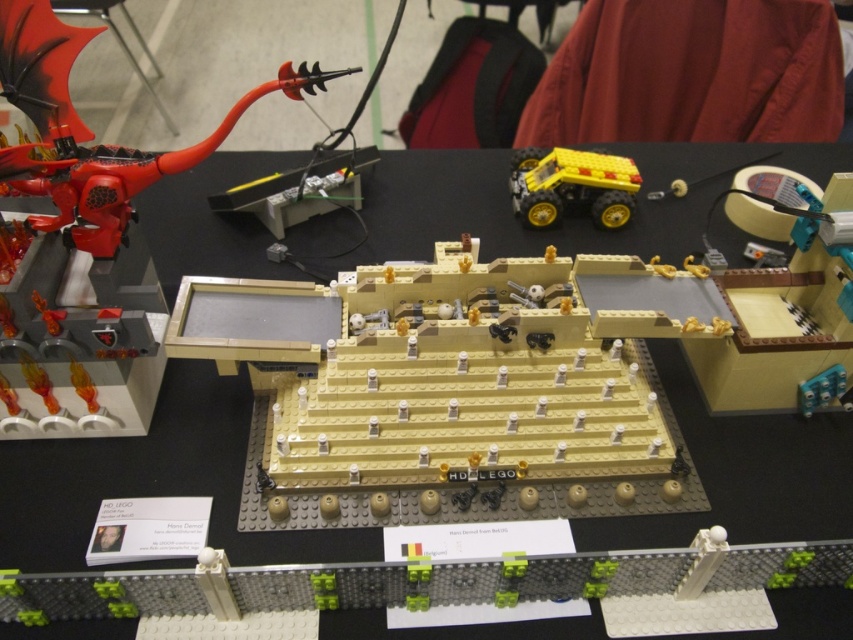
You are standing at the edge of the table where the shiny red dragon at left is placed. You want to pick up a small golden sphere located on the top level of the beige LEGO castle structure. Can you reach it without moving your body?

The shiny red dragon at left is 1.04 meters away from the viewer. Since the dragon is on the left side of the table and the golden sphere is on the top level of the beige LEGO castle, which is centrally located, the distance might be too far to reach without moving. However, the exact reachability depends on the user arm length, but based on the given distance, it might be challenging to reach 1.04 meters across the table. However, the problem states that the dragon is 1.04 meters from the viewer, but the 1

You are standing at the main castle structure in the LEGO model. You see two points marked as point 1 and point 2. Point 1 is at coordinate (757, 572) and point 2 is at coordinate (16, 83). If you want to place a new LEGO piece between these two points, which point should you place it closer to so that it is closer to the front of the model?

The point 1 at coordinate (757, 572) is in front of point 2 at coordinate (16, 83). Therefore, placing the new LEGO piece closer to point 1 would position it nearer to the front of the model.

You are standing 1.22 meters away from the point at coordinates (521, 496). Is the red LEGO dragon with a flame breath visible from your current position?

The point at coordinates (521, 496) is 1.22 meters away from the camera, so yes, the red LEGO dragon with a flame breath is visible from your current position.